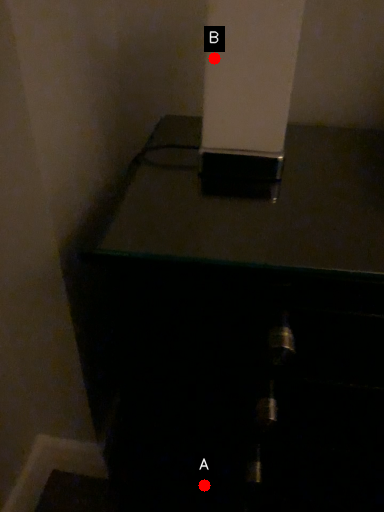
Question: Two points are circled on the image, labeled by A and B beside each circle. Which point is closer to the camera?

Choices:
 (A) A is closer
 (B) B is closer

Answer: (B)